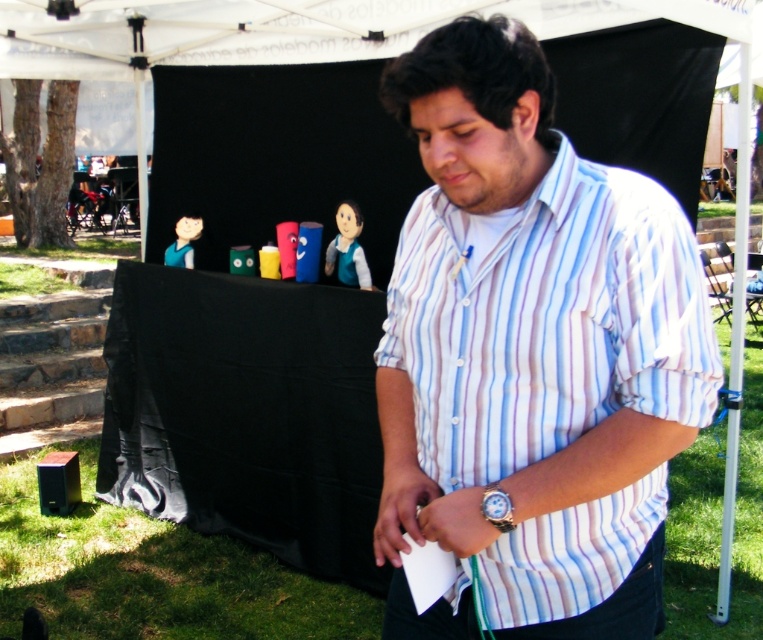
Which of these two, white striped shirt at center or silver metallic watch at lower right, stands taller?

Standing taller between the two is white striped shirt at center.

Measure the distance between white striped shirt at center and silver metallic watch at lower right.

white striped shirt at center and silver metallic watch at lower right are 12.41 inches apart from each other.

Describe the element at coordinates (530, 353) in the screenshot. I see `white striped shirt at center` at that location.

At what (x,y) coordinates should I click in order to perform the action: click on white striped shirt at center. Please return your answer as a coordinate pair (x, y). Looking at the image, I should click on (530, 353).

How distant is white fabric canopy at upper center from silver metallic watch at lower right?

white fabric canopy at upper center and silver metallic watch at lower right are 11.26 feet apart from each other.

Is point (477, 1) less distant than point (497, 500)?

That is False.

Where is `white fabric canopy at upper center`? This screenshot has height=640, width=763. white fabric canopy at upper center is located at coordinates (295, 28).

Between white striped shirt at center and white fabric canopy at upper center, which one has more height?

white striped shirt at center is taller.

Does white striped shirt at center have a smaller size compared to white fabric canopy at upper center?

Correct, white striped shirt at center occupies less space than white fabric canopy at upper center.

Who is more distant from viewer, (703, 291) or (147, 12)?

Positioned behind is point (147, 12).

I want to click on white striped shirt at center, so click(x=530, y=353).